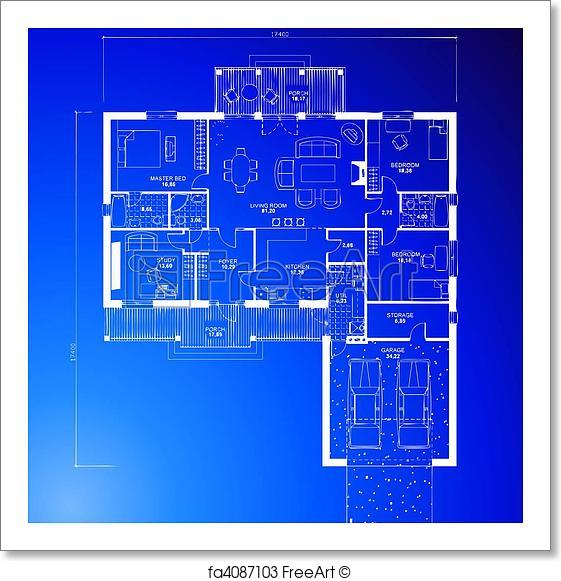
At what (x,y) coordinates should I click in order to perform the action: click on table. Please return your answer as a coordinate pair (x, y). Looking at the image, I should click on (238, 170).